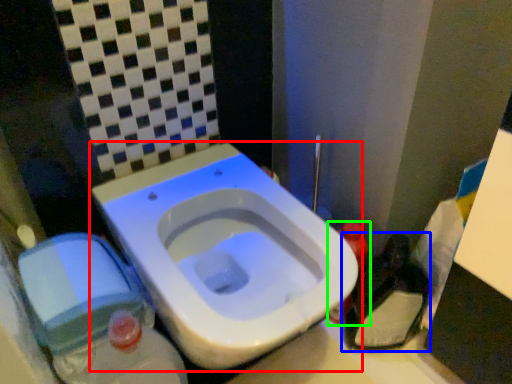
Question: Considering the real-world distances, which object is closest to toilet (highlighted by a red box)? garbage (highlighted by a blue box) or bottle (highlighted by a green box).

Choices:
 (A) garbage
 (B) bottle

Answer: (B)